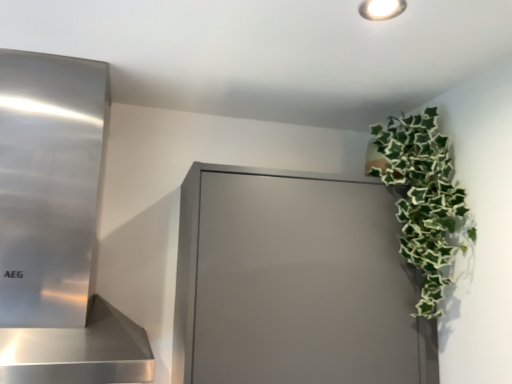
In order to face green leafy plant at upper right, should I rotate leftwards or rightwards?

You should look right and rotate roughly 18.235 degrees.

In order to click on polished stainless steel range hood at left in this screenshot , I will do `click(57, 228)`.

Can you tell me how much green leafy plant at upper right and matte gray cabinet at upper right differ in facing direction?

There is a 0.00039-degree angle between the facing directions of green leafy plant at upper right and matte gray cabinet at upper right.

Does point (435, 241) come in front of point (278, 231)?

No, (435, 241) is behind (278, 231).

Can you confirm if green leafy plant at upper right is wider than matte gray cabinet at upper right?

No, green leafy plant at upper right is not wider than matte gray cabinet at upper right.

Which is more to the left, matte gray cabinet at upper right or green leafy plant at upper right?

Positioned to the left is matte gray cabinet at upper right.

Considering the sizes of matte gray cabinet at upper right and green leafy plant at upper right in the image, is matte gray cabinet at upper right taller or shorter than green leafy plant at upper right?

In the image, matte gray cabinet at upper right appears to be taller than green leafy plant at upper right.

The image size is (512, 384). In order to click on houseplant above the matte gray cabinet at upper right (from the image's perspective) in this screenshot , I will do `click(424, 200)`.

Between polished stainless steel range hood at left and matte gray cabinet at upper right, which one has larger width?

Wider between the two is polished stainless steel range hood at left.

Is polished stainless steel range hood at left inside the boundaries of matte gray cabinet at upper right, or outside?

polished stainless steel range hood at left is spatially situated outside matte gray cabinet at upper right.

Which is behind, polished stainless steel range hood at left or matte gray cabinet at upper right?

matte gray cabinet at upper right.

From the picture: Which is closer, (x=21, y=254) or (x=337, y=245)?

Point (x=21, y=254) appears to be closer to the viewer than point (x=337, y=245).

From the image's perspective, is polished stainless steel range hood at left beneath green leafy plant at upper right?

No.

How many degrees apart are the facing directions of polished stainless steel range hood at left and green leafy plant at upper right?

0.309 degrees separate the facing orientations of polished stainless steel range hood at left and green leafy plant at upper right.

From a real-world perspective, does polished stainless steel range hood at left sit lower than green leafy plant at upper right?

Correct, in the physical world, polished stainless steel range hood at left is lower than green leafy plant at upper right.

Can you confirm if polished stainless steel range hood at left is positioned to the right of green leafy plant at upper right?

In fact, polished stainless steel range hood at left is to the left of green leafy plant at upper right.

How far apart are matte gray cabinet at upper right and polished stainless steel range hood at left?

matte gray cabinet at upper right is 15.63 inches away from polished stainless steel range hood at left.

Looking at this image, considering the relative positions of matte gray cabinet at upper right and polished stainless steel range hood at left in the image provided, is matte gray cabinet at upper right behind polished stainless steel range hood at left?

Yes.

In the scene shown: Which point is more distant from viewer, (192, 237) or (96, 349)?

The point (192, 237) is farther.

Based on the photo, considering the positions of objects matte gray cabinet at upper right and polished stainless steel range hood at left in the image provided, who is more to the left, matte gray cabinet at upper right or polished stainless steel range hood at left?

polished stainless steel range hood at left.

Considering the positions of objects green leafy plant at upper right and polished stainless steel range hood at left in the image provided, who is in front, green leafy plant at upper right or polished stainless steel range hood at left?

polished stainless steel range hood at left is closer to the camera.

You are a GUI agent. You are given a task and a screenshot of the screen. Output one action in this format:
    pyautogui.click(x=<x>, y=<y>)
    Task: Click on the houseplant behind the polished stainless steel range hood at left
    The height and width of the screenshot is (384, 512).
    Given the screenshot: What is the action you would take?
    pyautogui.click(x=424, y=200)

Is green leafy plant at upper right far away from polished stainless steel range hood at left?

That's not correct — green leafy plant at upper right is a little close to polished stainless steel range hood at left.

Locate an element on the screen. This screenshot has width=512, height=384. houseplant above the matte gray cabinet at upper right (from a real-world perspective) is located at coordinates click(424, 200).

At what (x,y) coordinates should I click in order to perform the action: click on glass door below the green leafy plant at upper right (from a real-world perspective). Please return your answer as a coordinate pair (x, y). The height and width of the screenshot is (384, 512). Looking at the image, I should click on (293, 283).

When comparing their distances from green leafy plant at upper right, does matte gray cabinet at upper right or polished stainless steel range hood at left seem further?

The object further to green leafy plant at upper right is polished stainless steel range hood at left.

When comparing their distances from polished stainless steel range hood at left, does green leafy plant at upper right or matte gray cabinet at upper right seem further?

green leafy plant at upper right.

Looking at the image, which one is located further to matte gray cabinet at upper right, polished stainless steel range hood at left or green leafy plant at upper right?

polished stainless steel range hood at left.

When comparing their distances from polished stainless steel range hood at left, does matte gray cabinet at upper right or green leafy plant at upper right seem further?

green leafy plant at upper right is positioned further to the anchor polished stainless steel range hood at left.

In the scene shown: Estimate the real-world distances between objects in this image. Which object is closer to green leafy plant at upper right, polished stainless steel range hood at left or matte gray cabinet at upper right?

matte gray cabinet at upper right is closer to green leafy plant at upper right.

Which object lies nearer to the anchor point matte gray cabinet at upper right, green leafy plant at upper right or polished stainless steel range hood at left?

green leafy plant at upper right lies closer to matte gray cabinet at upper right than the other object.

What are the coordinates of `glass door between polished stainless steel range hood at left and green leafy plant at upper right in the horizontal direction` in the screenshot? It's located at (293, 283).